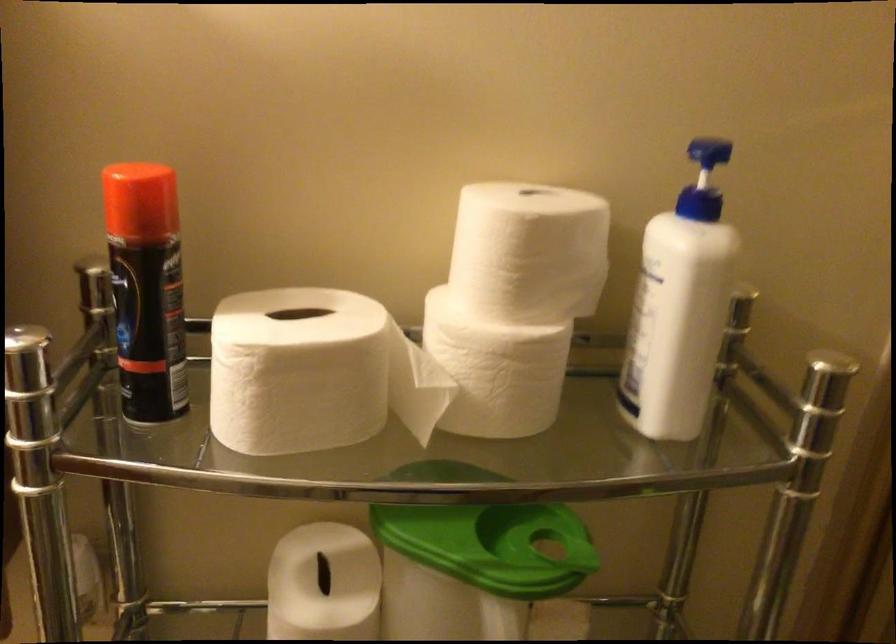
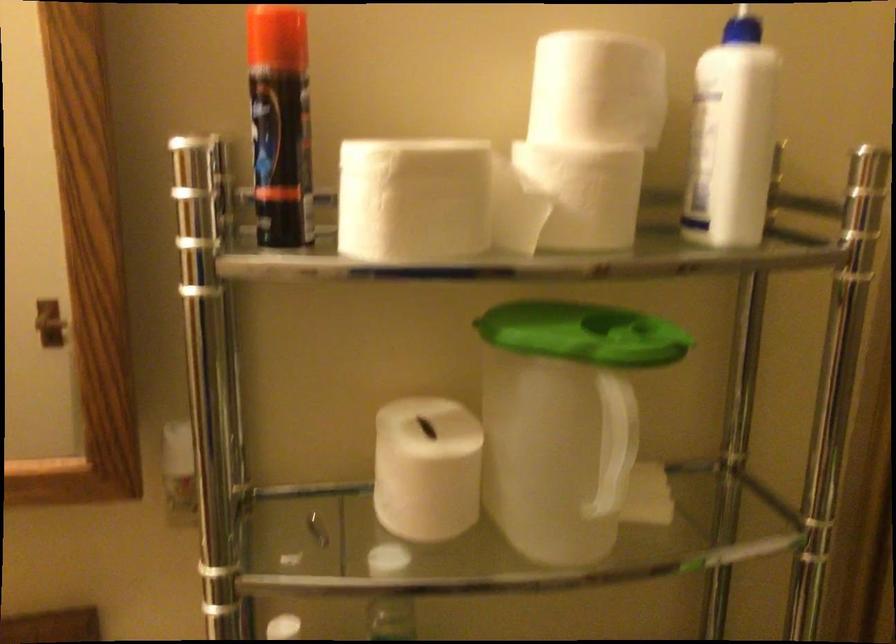
The point at (707, 182) is marked in the first image. Where is the corresponding point in the second image?

(742, 28)